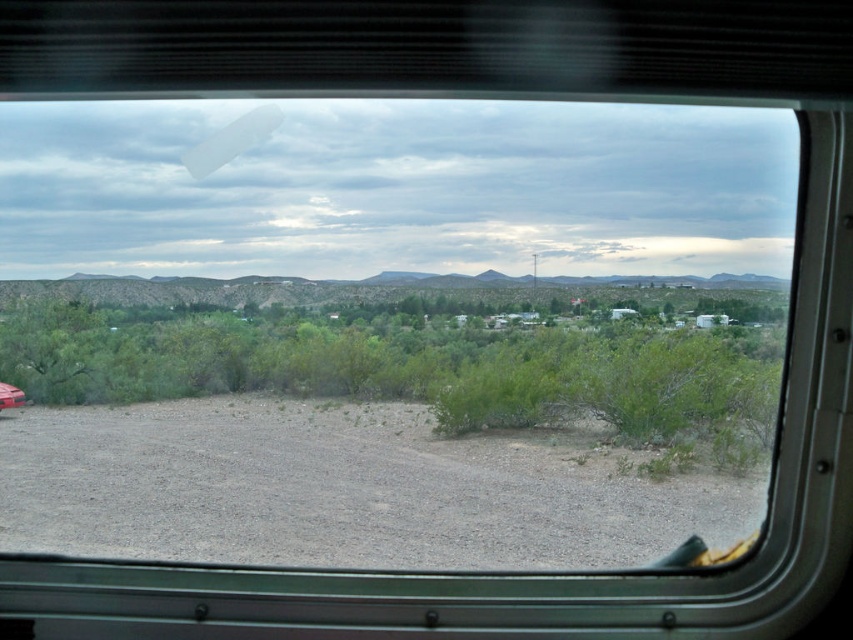
You are driving a truck that is 6 meters long and want to pass the matte red car at lower left on the gray gravel dirt track at lower left. Can your truck fit in the space available between them?

The gray gravel dirt track at lower left and matte red car at lower left are 8.31 meters apart from each other. Since your truck is 6 meters long, it can fit in the space available between them.

You are a passenger in the vehicle and notice the gray gravel dirt track at lower left and the matte red car at lower left outside the window. Which object is closer to the vehicle?

The gray gravel dirt track at lower left is closer to the vehicle because it is in front of the matte red car at lower left.

You are a passenger in the vehicle and notice the gray gravel dirt track at lower left and the matte red car at lower left. Which object is positioned higher from the ground level?

The gray gravel dirt track at lower left is much taller than the matte red car at lower left, so the gray gravel dirt track at lower left is positioned higher from the ground level.